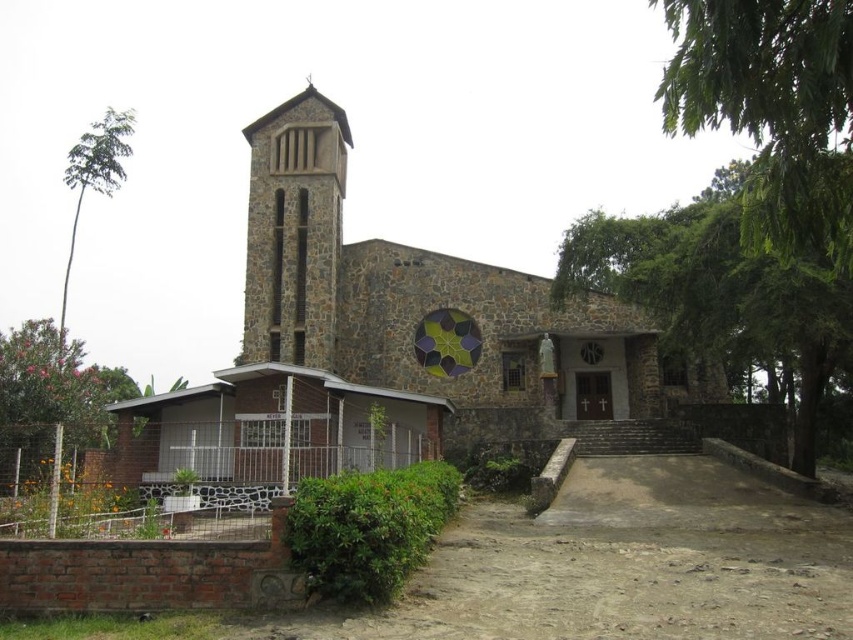
Is brown stone church at center in front of green leafy tree at lower left?

Yes, it is.

Can you confirm if brown stone church at center is positioned to the right of green leafy tree at lower left?

Yes, brown stone church at center is to the right of green leafy tree at lower left.

Identify the location of brown stone church at center. The width and height of the screenshot is (853, 640). (393, 344).

Can you confirm if green leafy tree at upper right is smaller than brown stone bell tower at left?

No.

Is green leafy tree at upper right to the right of brown stone bell tower at left from the viewer's perspective?

Yes, green leafy tree at upper right is to the right of brown stone bell tower at left.

At what (x,y) coordinates should I click in order to perform the action: click on green leafy tree at upper right. Please return your answer as a coordinate pair (x, y). The height and width of the screenshot is (640, 853). Looking at the image, I should click on (772, 109).

Which of these two, brown stone church at center or green leafy tree at upper right, stands taller?

green leafy tree at upper right is taller.

In the scene shown: Measure the distance between brown stone church at center and green leafy tree at upper right.

brown stone church at center is 39.30 meters away from green leafy tree at upper right.

Describe the element at coordinates (393, 344) in the screenshot. I see `brown stone church at center` at that location.

I want to click on brown stone church at center, so click(x=393, y=344).